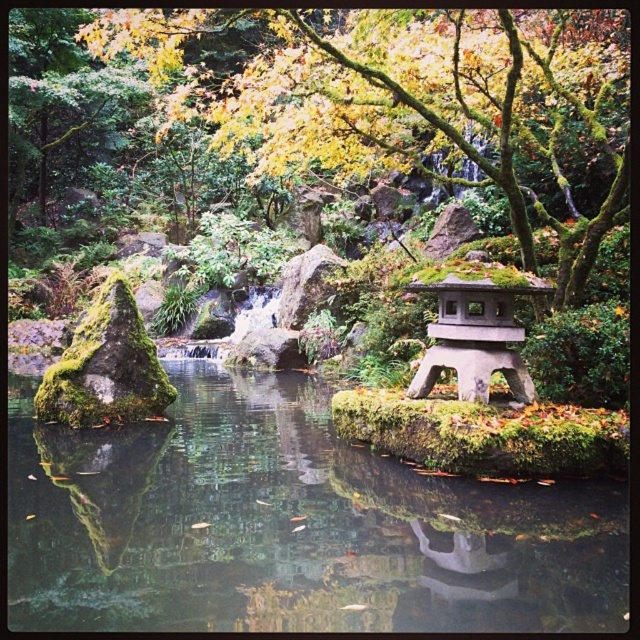
Question: Which point is closer to the camera?

Choices:
 (A) green mossy rock at center
 (B) gray stone gazebo at center-right
 (C) green mossy tree at upper center

Answer: (A)

Question: Is green mossy rock at center to the left of gray stone gazebo at center-right from the viewer's perspective?

Choices:
 (A) yes
 (B) no

Answer: (A)

Question: Observing the image, what is the correct spatial positioning of green mossy rock at center in reference to gray stone gazebo at center-right?

Choices:
 (A) left
 (B) right

Answer: (A)

Question: Does green mossy tree at upper center appear on the right side of gray stone gazebo at center-right?

Choices:
 (A) no
 (B) yes

Answer: (A)

Question: Considering the real-world distances, which object is closest to the gray stone gazebo at center-right?

Choices:
 (A) green mossy rock at center
 (B) green mossy tree at upper center

Answer: (A)

Question: Which point is farther to the camera?

Choices:
 (A) (445, 104)
 (B) (456, 355)

Answer: (A)